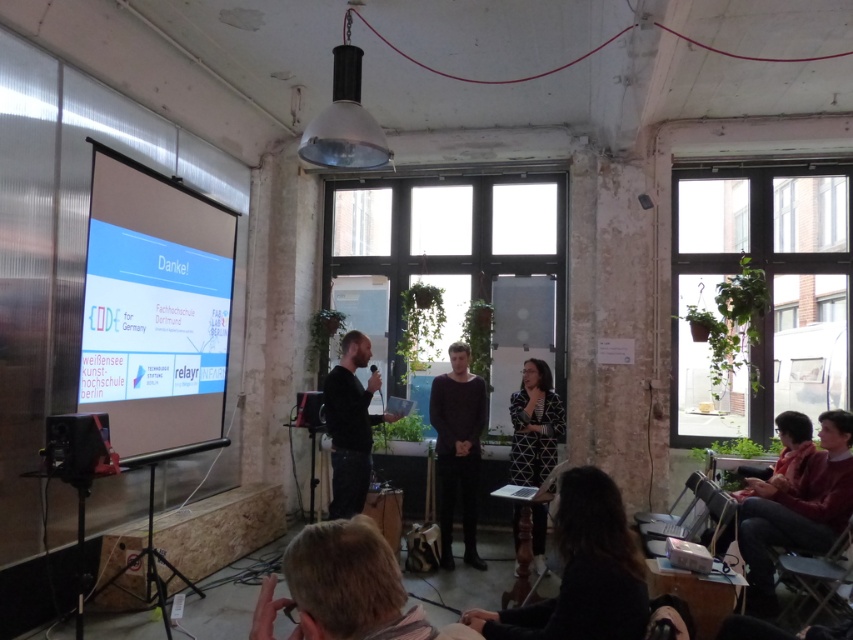
Question: Estimate the real-world distances between objects in this image. Which object is closer to the dark red sweater at lower right?

Choices:
 (A) dark brown leather jacket at lower right
 (B) black fabric at lower center

Answer: (A)

Question: From the image, what is the correct spatial relationship of blonde hair at lower center in relation to black printed dress at center?

Choices:
 (A) right
 (B) left

Answer: (B)

Question: Can you confirm if black fabric at lower center is positioned to the right of dark red sweater at lower right?

Choices:
 (A) yes
 (B) no

Answer: (B)

Question: Which is farther from the dark brown leather jacket at lower right?

Choices:
 (A) dark red sweater at lower right
 (B) black printed dress at center
 (C) matte white projection screen at left
 (D) black matte shirt at center

Answer: (C)

Question: Can you confirm if black fabric at lower center is positioned to the right of black matte shirt at center?

Choices:
 (A) no
 (B) yes

Answer: (B)

Question: Which object is positioned closest to the dark red sweater at lower right?

Choices:
 (A) dark brown leather jacket at lower right
 (B) matte white projection screen at left

Answer: (A)